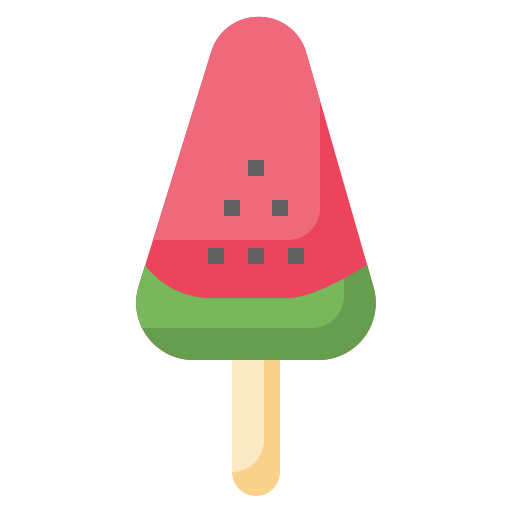
You are a GUI agent. You are given a task and a screenshot of the screen. Output one action in this format:
    pyautogui.click(x=<x>, y=<y>)
    Task: Click on the tan section
    The width and height of the screenshot is (512, 512).
    Given the screenshot: What is the action you would take?
    pyautogui.click(x=256, y=484)